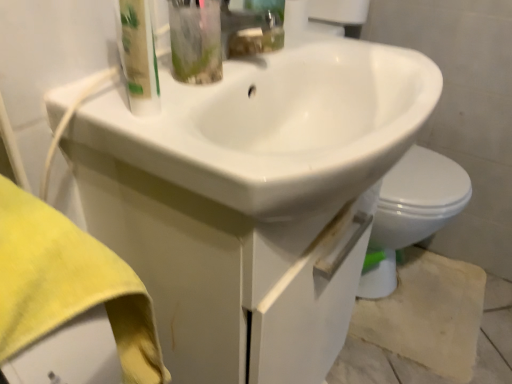
Question: From a real-world perspective, relative to white glossy drawer at center, is white glossy sink at center vertically above or below?

Choices:
 (A) above
 (B) below

Answer: (A)

Question: Choose the correct answer: Is white glossy sink at center inside white glossy drawer at center or outside it?

Choices:
 (A) outside
 (B) inside

Answer: (B)

Question: Which of these objects is positioned farthest from the white glossy sink at center?

Choices:
 (A) translucent plastic bottle at upper left
 (B) beige textured concrete at lower right
 (C) white glossy drawer at center

Answer: (B)

Question: Considering the real-world distances, which object is farthest from the white glossy drawer at center?

Choices:
 (A) translucent plastic bottle at upper left
 (B) white glossy sink at center
 (C) beige textured concrete at lower right

Answer: (C)